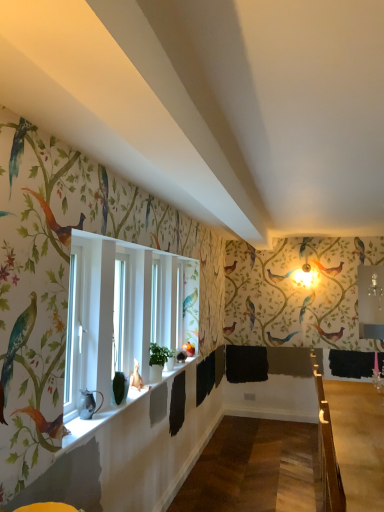
Question: From a real-world perspective, does white glossy window sill at lower center sit lower than wooden at right?

Choices:
 (A) yes
 (B) no

Answer: (B)

Question: Is white glossy window sill at lower center not close to wooden at right?

Choices:
 (A) no
 (B) yes

Answer: (B)

Question: Could wooden at right be considered to be inside white glossy window sill at lower center?

Choices:
 (A) no
 (B) yes

Answer: (A)

Question: From a real-world perspective, is white glossy window sill at lower center located higher than wooden at right?

Choices:
 (A) yes
 (B) no

Answer: (A)

Question: Can you see white glossy window sill at lower center touching wooden at right?

Choices:
 (A) yes
 (B) no

Answer: (B)

Question: Considering the positions of wooden at right and matte black pitcher at window in the image, is wooden at right taller or shorter than matte black pitcher at window?

Choices:
 (A) short
 (B) tall

Answer: (B)

Question: Considering the relative positions of wooden at right and matte black pitcher at window in the image provided, is wooden at right to the left or to the right of matte black pitcher at window?

Choices:
 (A) left
 (B) right

Answer: (B)

Question: Looking at the image, does wooden at right seem bigger or smaller compared to matte black pitcher at window?

Choices:
 (A) big
 (B) small

Answer: (A)

Question: Do you think wooden at right is within matte black pitcher at window, or outside of it?

Choices:
 (A) inside
 (B) outside

Answer: (B)

Question: Visually, is wooden at right positioned to the left or to the right of white glossy window sill at lower center?

Choices:
 (A) left
 (B) right

Answer: (B)

Question: From a real-world perspective, is wooden at right positioned above or below white glossy window sill at lower center?

Choices:
 (A) below
 (B) above

Answer: (A)

Question: Looking at their shapes, would you say wooden at right is wider or thinner than white glossy window sill at lower center?

Choices:
 (A) thin
 (B) wide

Answer: (B)

Question: Does point (314, 385) appear closer or farther from the camera than point (185, 361)?

Choices:
 (A) farther
 (B) closer

Answer: (A)

Question: Looking at the image, does white glossy window sill at lower center seem bigger or smaller compared to wooden at right?

Choices:
 (A) small
 (B) big

Answer: (A)

Question: From a real-world perspective, relative to wooden at right, is white glossy window sill at lower center vertically above or below?

Choices:
 (A) above
 (B) below

Answer: (A)